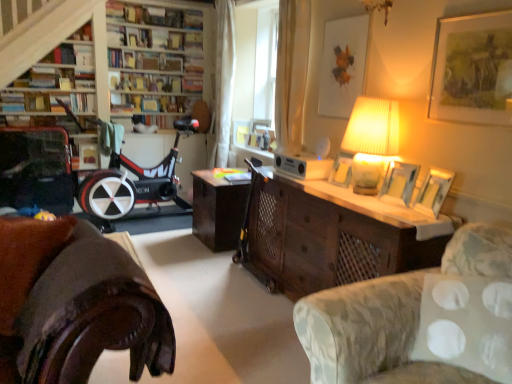
This screenshot has width=512, height=384. I want to click on vacant area that is in front of matte yellow lampshade at upper right, so click(367, 206).